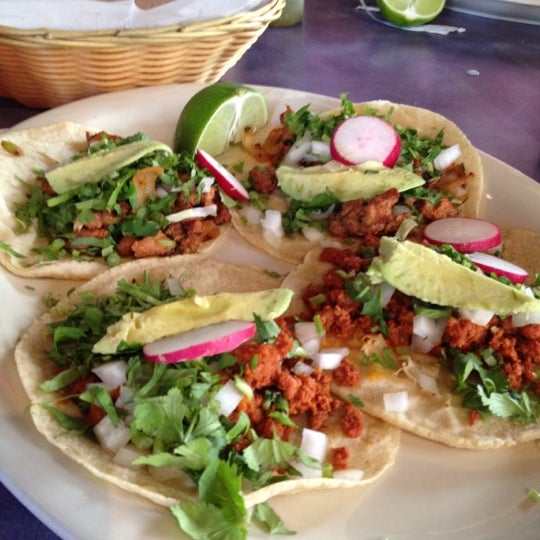
The height and width of the screenshot is (540, 540). Find the location of `basket`. basket is located at coordinates (180, 56).